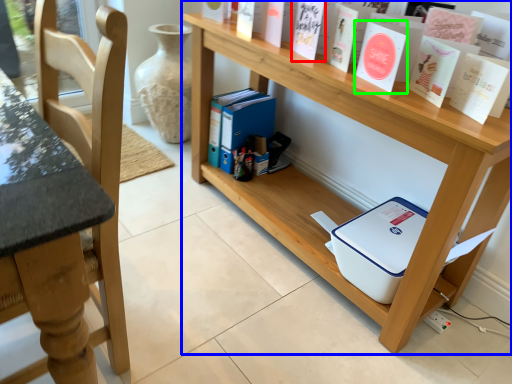
Question: Estimate the real-world distances between objects in this image. Which object is farther from paperback book (highlighted by a red box), shelf (highlighted by a blue box) or paperback book (highlighted by a green box)?

Choices:
 (A) shelf
 (B) paperback book

Answer: (A)